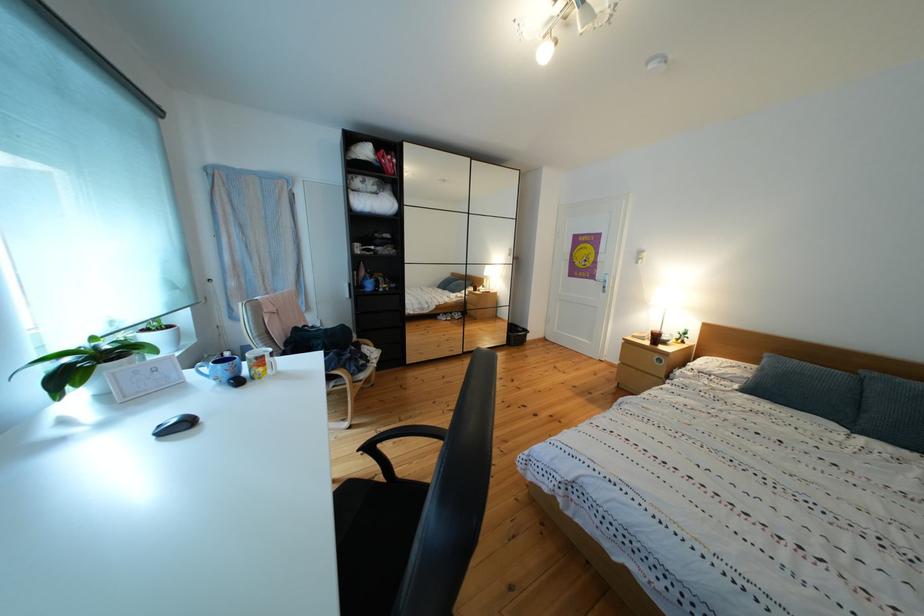
What do you see at coordinates (671, 376) in the screenshot?
I see `the nightstand drawer knob` at bounding box center [671, 376].